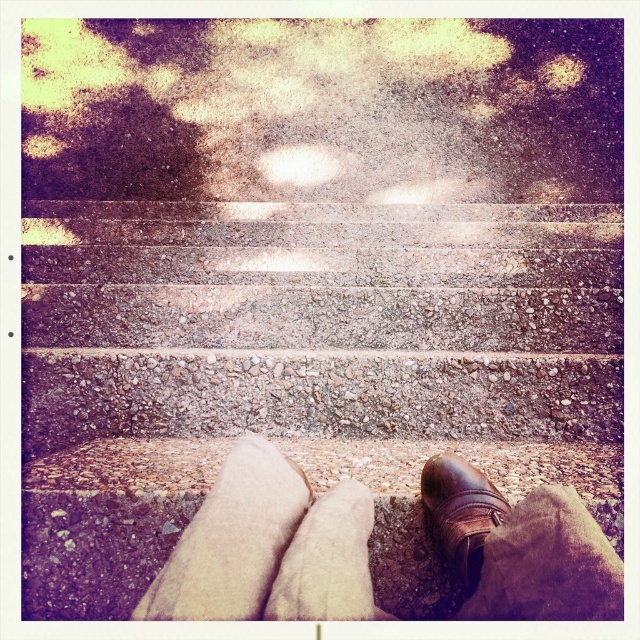
Is beige wool sock at lower center thinner than brown leather shoe at lower center?

Yes, beige wool sock at lower center is thinner than brown leather shoe at lower center.

You are a GUI agent. You are given a task and a screenshot of the screen. Output one action in this format:
    pyautogui.click(x=<x>, y=<y>)
    Task: Click on the beige wool sock at lower center
    
    Given the screenshot: What is the action you would take?
    pyautogui.click(x=326, y=561)

Where is `beige wool sock at lower center`? The image size is (640, 640). beige wool sock at lower center is located at coordinates (326, 561).

Which is more to the right, concrete textured stairs at center or brown leather shoe at lower center?

Positioned to the right is brown leather shoe at lower center.

Is concrete textured stairs at center to the right of brown leather shoe at lower center from the viewer's perspective?

No, concrete textured stairs at center is not to the right of brown leather shoe at lower center.

The width and height of the screenshot is (640, 640). What are the coordinates of `concrete textured stairs at center` in the screenshot? It's located at (305, 371).

Who is taller, beige suede foot at lower center or beige wool sock at lower center?

With more height is beige wool sock at lower center.

Which is more to the right, beige suede foot at lower center or beige wool sock at lower center?

beige wool sock at lower center

At what (x,y) coordinates should I click in order to perform the action: click on beige suede foot at lower center. Please return your answer as a coordinate pair (x, y). This screenshot has width=640, height=640. Looking at the image, I should click on (230, 540).

The width and height of the screenshot is (640, 640). In order to click on beige suede foot at lower center in this screenshot , I will do `click(230, 540)`.